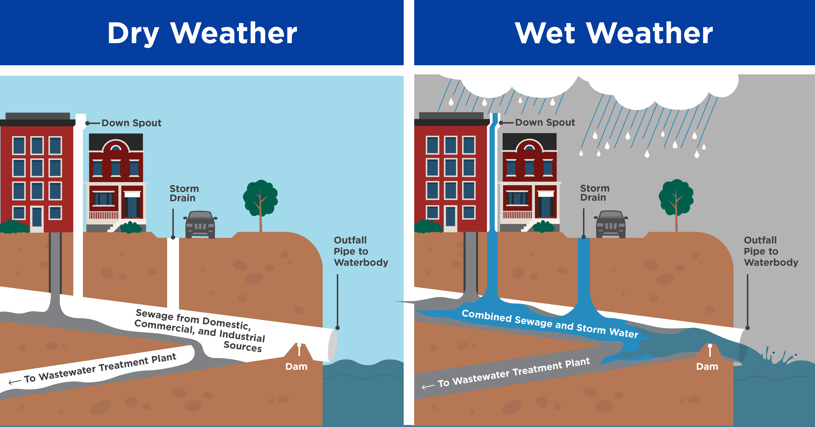
Identify the location of door. The height and width of the screenshot is (427, 815). (34, 228), (134, 207), (447, 228), (544, 204).